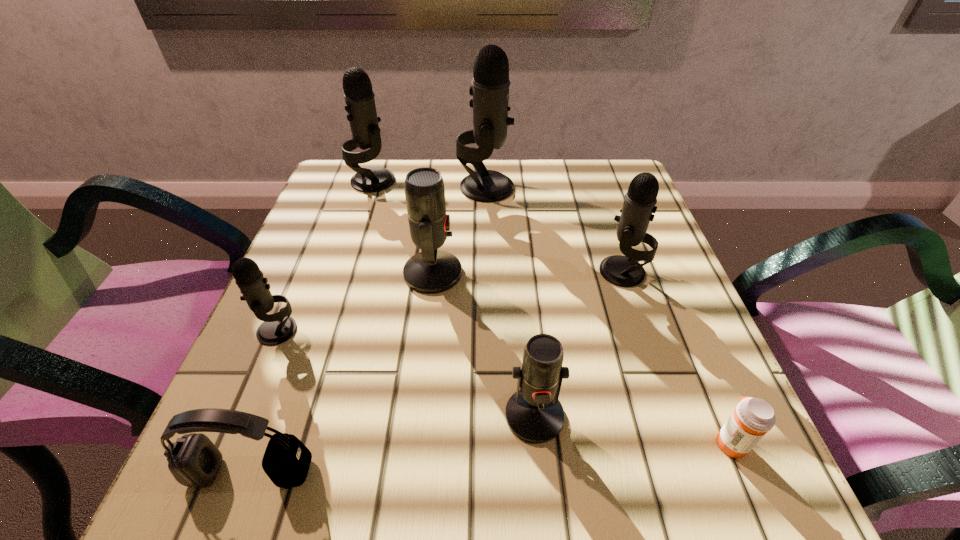
Locate an element on the screen. This screenshot has height=540, width=960. the biggest black microphone is located at coordinates (490, 90).

Find the location of a particular element. the second black microphone from right to left is located at coordinates (490, 90).

Locate an element on the screen. The height and width of the screenshot is (540, 960). the second tallest object is located at coordinates (360, 105).

This screenshot has height=540, width=960. In order to click on the second tallest microphone in this screenshot , I will do `click(360, 105)`.

The width and height of the screenshot is (960, 540). What are the coordinates of `the bigger red microphone` in the screenshot? It's located at (431, 271).

The height and width of the screenshot is (540, 960). Identify the location of the farther red microphone. (431, 271).

Where is `the rightmost black microphone`? Image resolution: width=960 pixels, height=540 pixels. the rightmost black microphone is located at coordinates (640, 200).

Where is `the rightmost microphone`? the rightmost microphone is located at coordinates (640, 200).

Find the location of a particular element. the fourth nearest object is located at coordinates (277, 328).

Locate an element on the screen. the nearest black microphone is located at coordinates (277, 328).